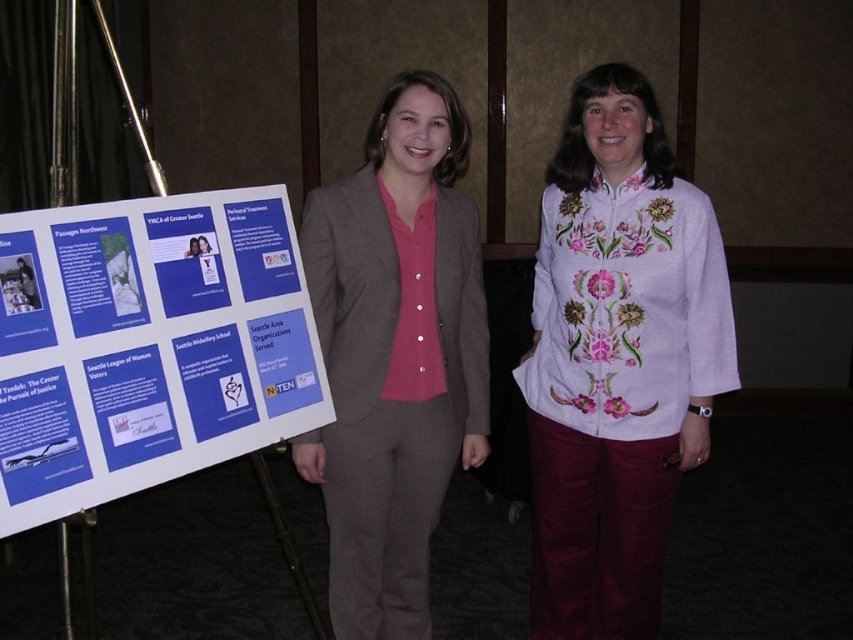
Is point (587, 480) positioned behind point (409, 385)?

Yes, it is behind point (409, 385).

Between point (618, 168) and point (334, 548), which one is positioned behind?

The point (334, 548) is behind.

Identify the location of white embroidered blouse at center. pos(618,358).

Who is higher up, blue paper poster at left or white embroidered blouse at center?

blue paper poster at left is higher up.

Between point (27, 364) and point (608, 435), which one is positioned behind?

The point (608, 435) is more distant.

I want to click on blue paper poster at left, so click(148, 346).

Is blue paper poster at left to the right of matte gray suit at center from the viewer's perspective?

Incorrect, blue paper poster at left is not on the right side of matte gray suit at center.

Is point (234, 296) closer to viewer compared to point (329, 228)?

Yes, it is.

I want to click on blue paper poster at left, so click(x=148, y=346).